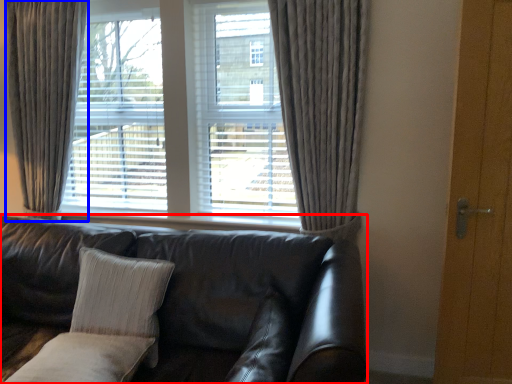
Question: Among these objects, which one is nearest to the camera, studio couch (highlighted by a red box) or curtain (highlighted by a blue box)?

Choices:
 (A) studio couch
 (B) curtain

Answer: (A)